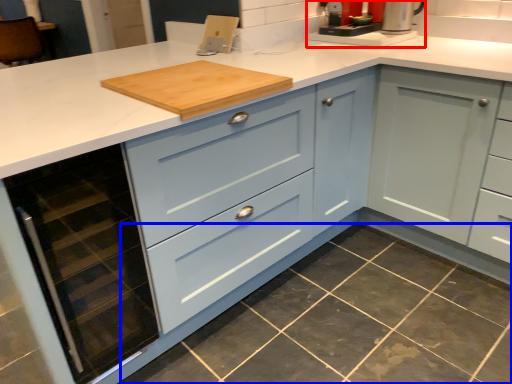
Question: Which object appears closest to the camera in this image, coffee machine (highlighted by a red box) or granite (highlighted by a blue box)?

Choices:
 (A) coffee machine
 (B) granite

Answer: (B)